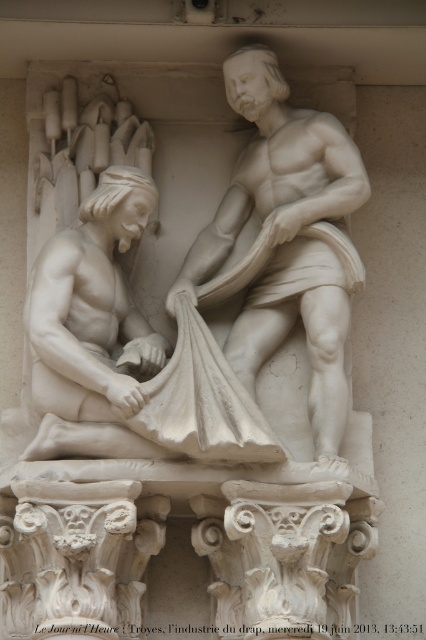
You are an art conservator examining the sculpture. You need to clean the white marble man at left and the white marble statue at center. Based on their positions, which one is closer to you?

The white marble man at left is closer to you because it is in front of the white marble statue at center.

Based on the scene description, if you were standing directly in front of the sculpture, which object would you see higher up, the white marble man at left or the white marble statue at center?

The white marble statue at center is higher up because the white marble man at left is located below it.

Based on the photo, you are standing in front of a marble relief sculpture. You want to locate the white marble man at left. Where should you look relative to the center of the sculpture?

The white marble man at left is located at point [129,349], which means you should look slightly to the right and down from the center of the sculpture.